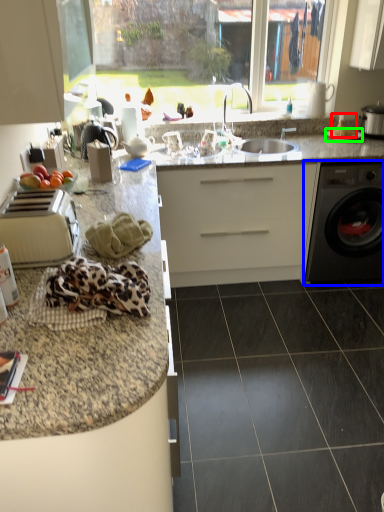
Question: Which object is the farthest from food (highlighted by a red box)? Choose among these: washing machine (highlighted by a blue box) or gas stove (highlighted by a green box).

Choices:
 (A) washing machine
 (B) gas stove

Answer: (A)